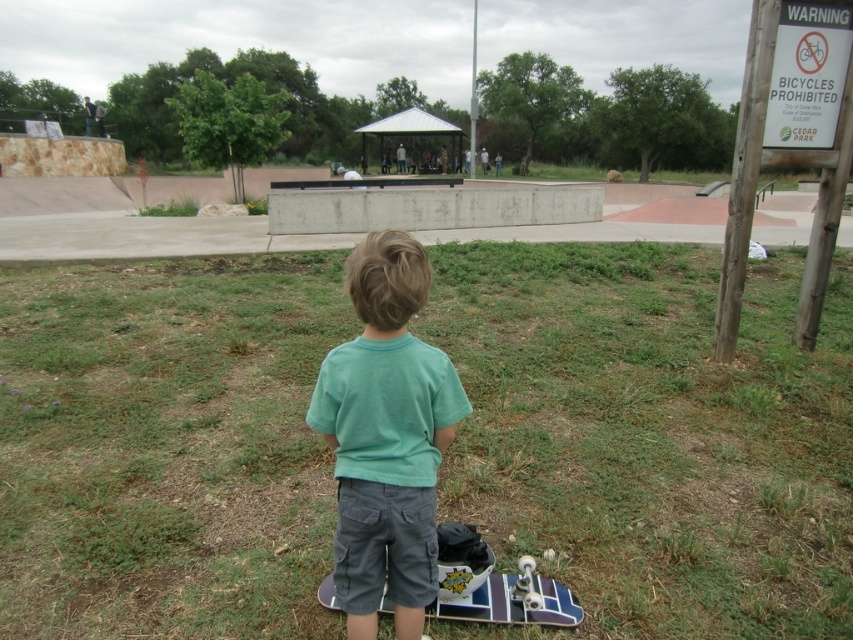
Question: In this image, where is green grass at lower center located relative to green cotton shirt at center?

Choices:
 (A) right
 (B) left

Answer: (A)

Question: Is green grass at lower center thinner than green cotton shirt at center?

Choices:
 (A) no
 (B) yes

Answer: (A)

Question: Can you confirm if green grass at lower center is bigger than green cotton shirt at center?

Choices:
 (A) no
 (B) yes

Answer: (B)

Question: Among these points, which one is nearest to the camera?

Choices:
 (A) (335, 547)
 (B) (558, 525)

Answer: (A)

Question: Among these points, which one is farthest from the camera?

Choices:
 (A) (224, 273)
 (B) (344, 454)

Answer: (A)